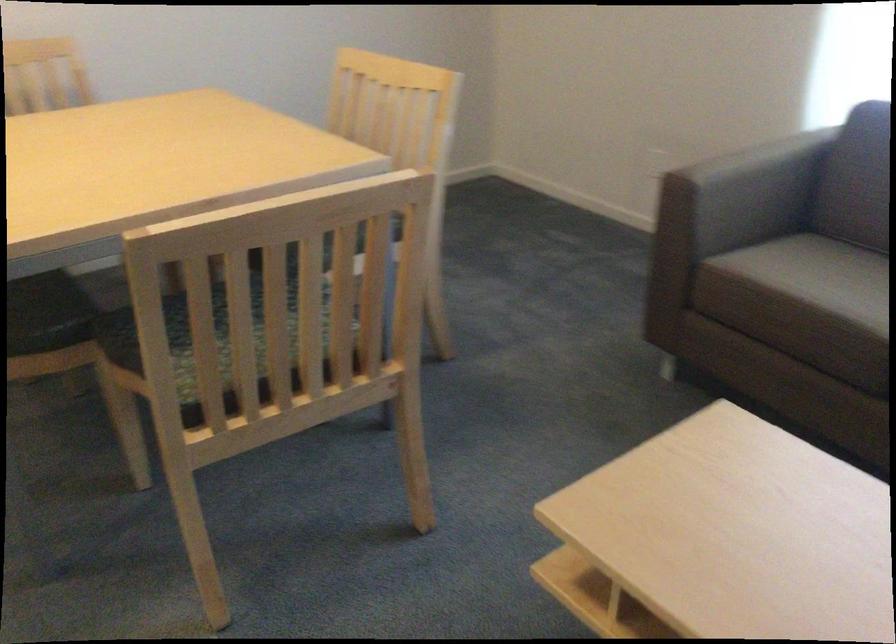
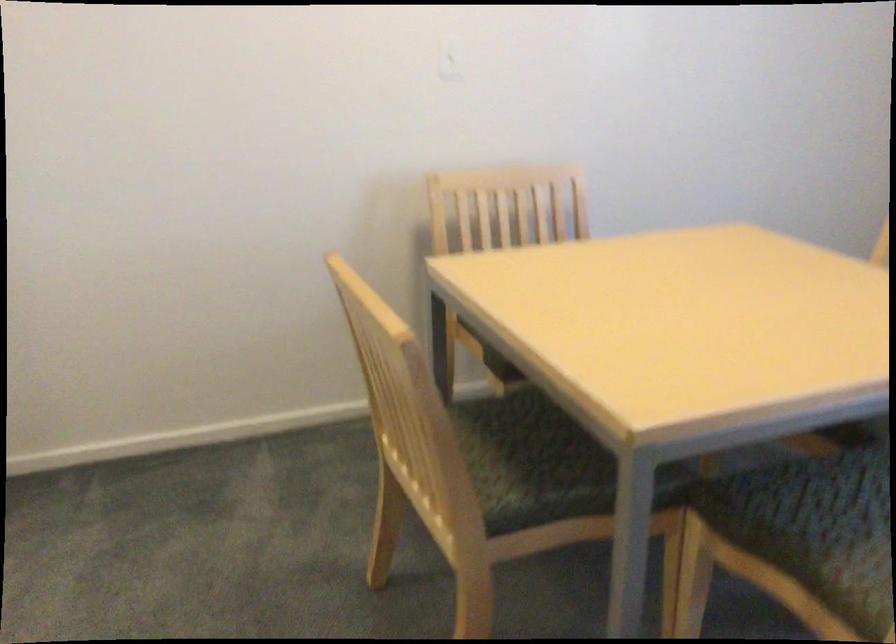
Question: The camera is either moving clockwise (left) or counter-clockwise (right) around the object. The first image is from the beginning of the video and the second image is from the end. Is the camera moving left or right when shooting the video?

Choices:
 (A) Left
 (B) Right

Answer: (B)